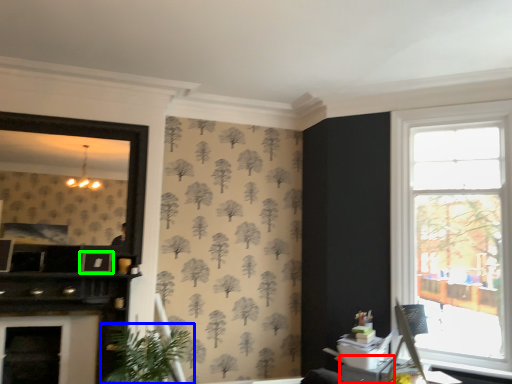
Question: Which object is positioned farthest from table (highlighted by a red box)? Select from houseplant (highlighted by a blue box) and picture frame (highlighted by a green box).

Choices:
 (A) houseplant
 (B) picture frame

Answer: (B)